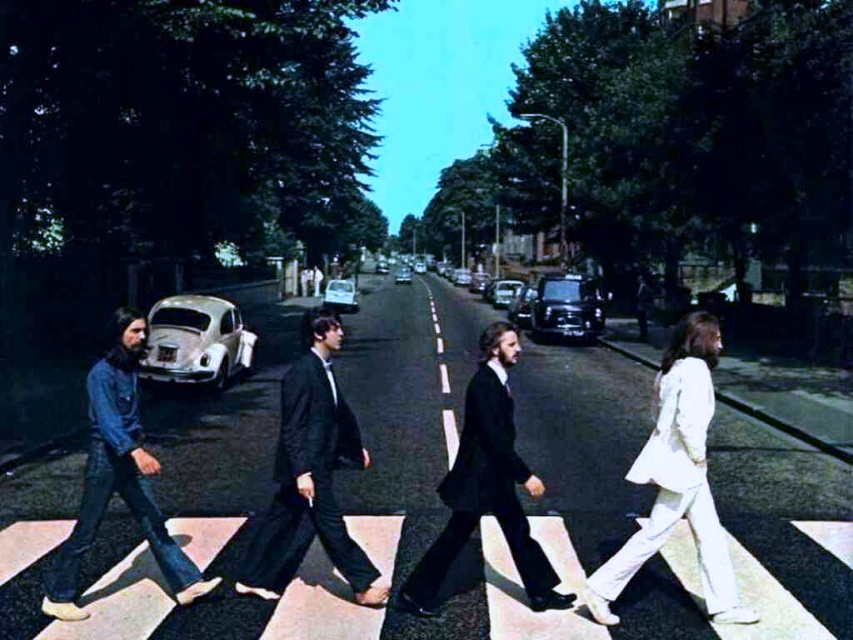
Is black textured suit at center to the right of black suit at center from the viewer's perspective?

Incorrect, black textured suit at center is not on the right side of black suit at center.

Which is below, black textured suit at center or black suit at center?

black textured suit at center

Is point (242, 579) closer to camera compared to point (473, 481)?

No, (242, 579) is behind (473, 481).

Find the location of a particular element. black textured suit at center is located at coordinates (310, 476).

Is point (346, 572) positioned in front of point (86, 500)?

No, (346, 572) is further to viewer.

Does point (273, 589) come farther from viewer compared to point (77, 548)?

Yes, point (273, 589) is farther from viewer.

Identify the location of black textured suit at center. (310, 476).

Is black suit at center bigger than denim jacket at left?

Actually, black suit at center might be smaller than denim jacket at left.

How far apart are black suit at center and denim jacket at left?

black suit at center is 7.84 feet from denim jacket at left.

Does point (445, 522) lie in front of point (70, 582)?

No, it is behind (70, 582).

Find the location of `black suit at center`. black suit at center is located at coordinates (486, 484).